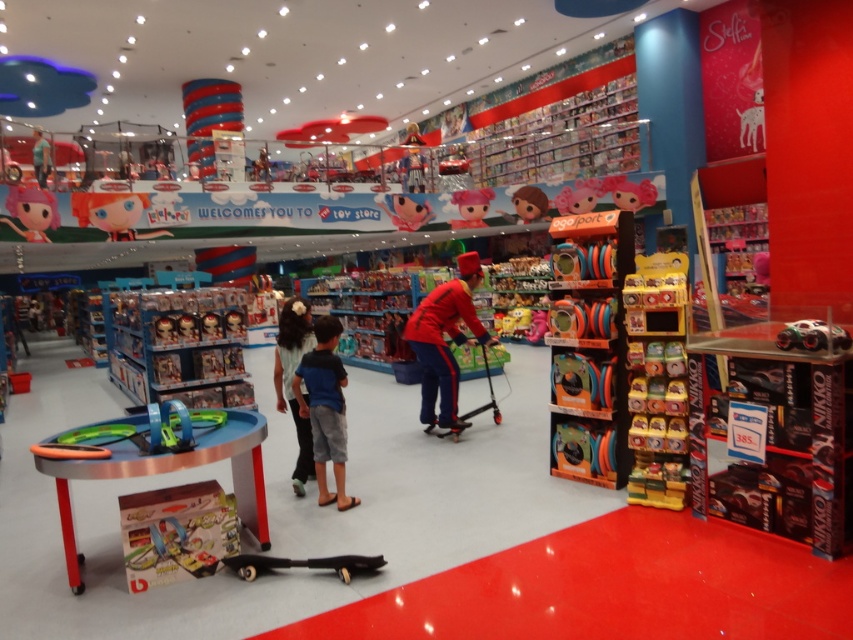
Question: Is red matte scooter at center further to camera compared to shiny plastic doll at upper left?

Choices:
 (A) yes
 (B) no

Answer: (B)

Question: Which point is closer to the camera taking this photo?

Choices:
 (A) (407, 221)
 (B) (532, 216)

Answer: (A)

Question: Among these points, which one is farthest from the camera?

Choices:
 (A) (614, 376)
 (B) (277, 344)

Answer: (B)

Question: Does light blue denim jeans at center appear on the right side of matte plastic doll at center?

Choices:
 (A) yes
 (B) no

Answer: (B)

Question: Does blue cotton shorts at center appear on the left side of matte pink doll at upper left?

Choices:
 (A) yes
 (B) no

Answer: (B)

Question: Estimate the real-world distances between objects in this image. Which object is closer to the matte pink doll at upper left?

Choices:
 (A) orange matte sport disc at center right
 (B) matte black doll at upper left
 (C) shiny plastic doll at upper left
 (D) light blue denim jeans at center

Answer: (C)